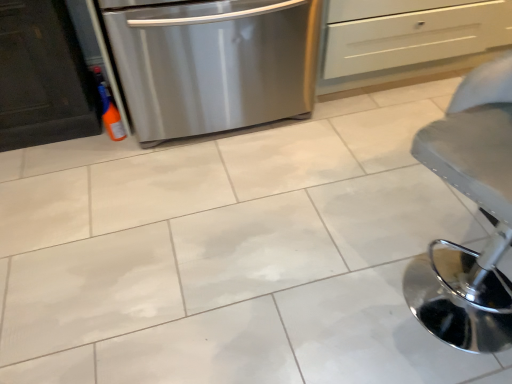
Find the location of a particular element. Image resolution: width=512 pixels, height=384 pixels. free space in front of white matte drawer at upper center is located at coordinates (372, 141).